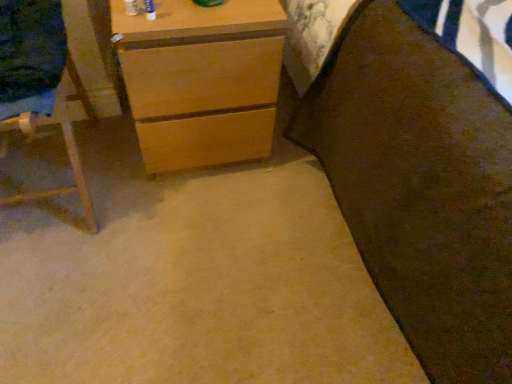
Where is `vacant area that lies between light brown wood chest of drawers at upper left and wooden easel at left`? The height and width of the screenshot is (384, 512). vacant area that lies between light brown wood chest of drawers at upper left and wooden easel at left is located at coordinates point(135,170).